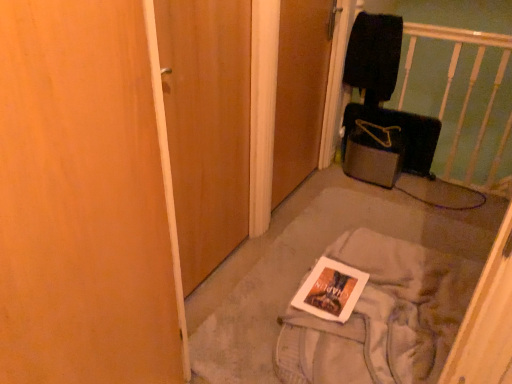
Question: Can you see wooden door at center, which is the 2th door in left-to-right order, touching wooden door at center, the 1th door when ordered from left to right?

Choices:
 (A) yes
 (B) no

Answer: (B)

Question: Is the position of wooden door at center, which is counted as the 1th door, starting from the right, more distant than that of wooden door at center, the 2th door when ordered from right to left?

Choices:
 (A) no
 (B) yes

Answer: (B)

Question: From a real-world perspective, is wooden door at center, which is counted as the 1th door, starting from the right, positioned over wooden door at center, the 1th door when ordered from left to right, based on gravity?

Choices:
 (A) yes
 (B) no

Answer: (B)

Question: Does wooden door at center, which is the 2th door in left-to-right order, have a larger size compared to wooden door at center, the 1th door when ordered from left to right?

Choices:
 (A) no
 (B) yes

Answer: (B)

Question: Is wooden door at center, which is counted as the 1th door, starting from the right, completely or partially outside of wooden door at center, the 1th door when ordered from left to right?

Choices:
 (A) yes
 (B) no

Answer: (A)

Question: From the image's perspective, would you say wooden door at center, which is counted as the 1th door, starting from the right, is positioned over wooden door at center, the 1th door when ordered from left to right?

Choices:
 (A) no
 (B) yes

Answer: (B)

Question: Is wooden door at center, the 1th door when ordered from left to right, far from white paper at center?

Choices:
 (A) no
 (B) yes

Answer: (A)

Question: Is wooden door at center, the 2th door when ordered from right to left, bigger than white paper at center?

Choices:
 (A) yes
 (B) no

Answer: (B)

Question: From the image's perspective, is wooden door at center, the 2th door when ordered from right to left, beneath white paper at center?

Choices:
 (A) yes
 (B) no

Answer: (B)

Question: Considering the relative sizes of wooden door at center, the 1th door when ordered from left to right, and white paper at center in the image provided, is wooden door at center, the 1th door when ordered from left to right, shorter than white paper at center?

Choices:
 (A) yes
 (B) no

Answer: (B)

Question: From the image's perspective, is wooden door at center, the 2th door when ordered from right to left, over white paper at center?

Choices:
 (A) yes
 (B) no

Answer: (A)

Question: Is wooden door at center, the 1th door when ordered from left to right, to the left of white paper at center from the viewer's perspective?

Choices:
 (A) no
 (B) yes

Answer: (B)

Question: Is white glossy magazine at center bigger than black fabric infant bed at upper right?

Choices:
 (A) no
 (B) yes

Answer: (A)